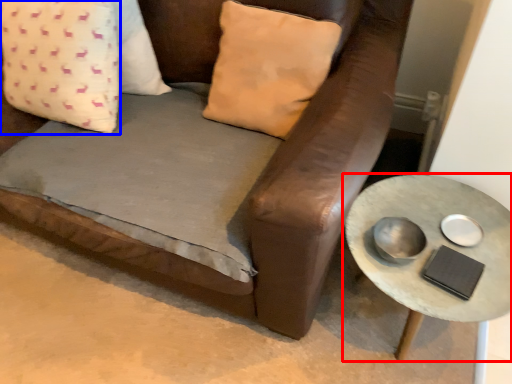
Question: Among these objects, which one is nearest to the camera, table (highlighted by a red box) or pillow (highlighted by a blue box)?

Choices:
 (A) table
 (B) pillow

Answer: (A)